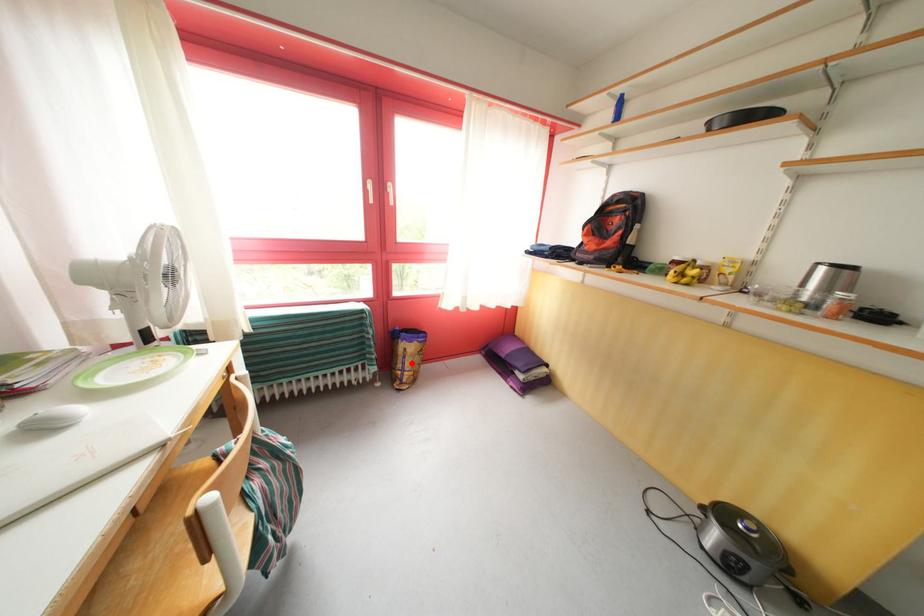
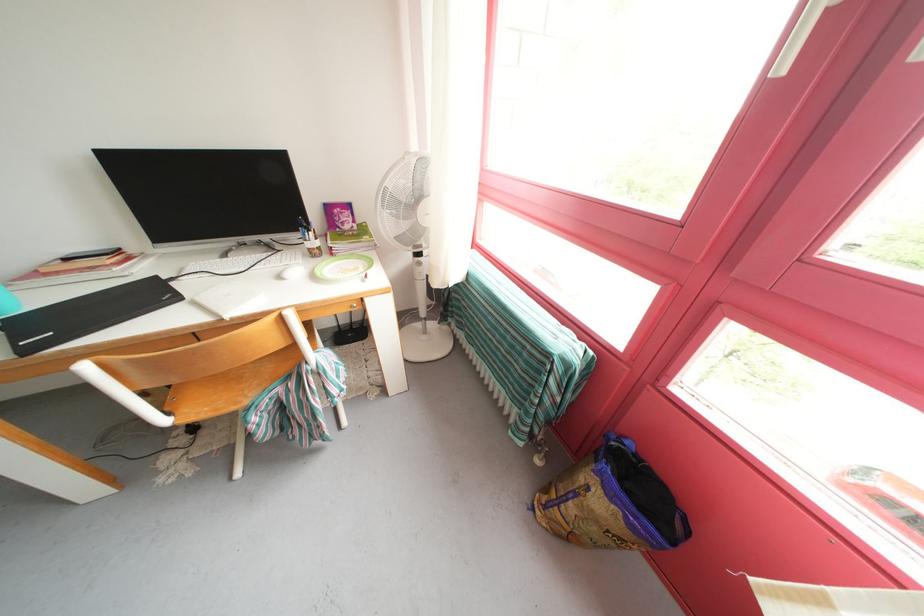
Question: I am providing you with two images of the same scene from different viewpoints. A red point is shown in image1. For the corresponding object point in image2, is it positioned nearer or farther from the camera?

Choices:
 (A) Nearer
 (B) Farther

Answer: (A)